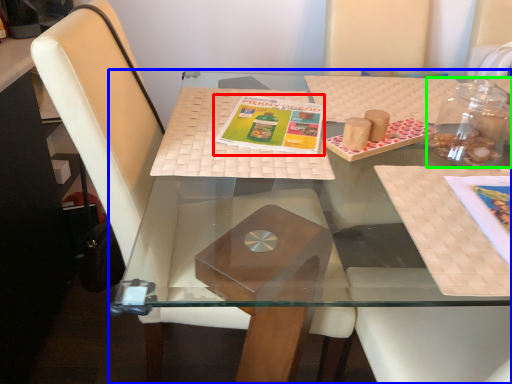
Question: Considering the real-world distances, which object is closest to book cover (highlighted by a red box)? table (highlighted by a blue box) or glass jar (highlighted by a green box).

Choices:
 (A) table
 (B) glass jar

Answer: (A)